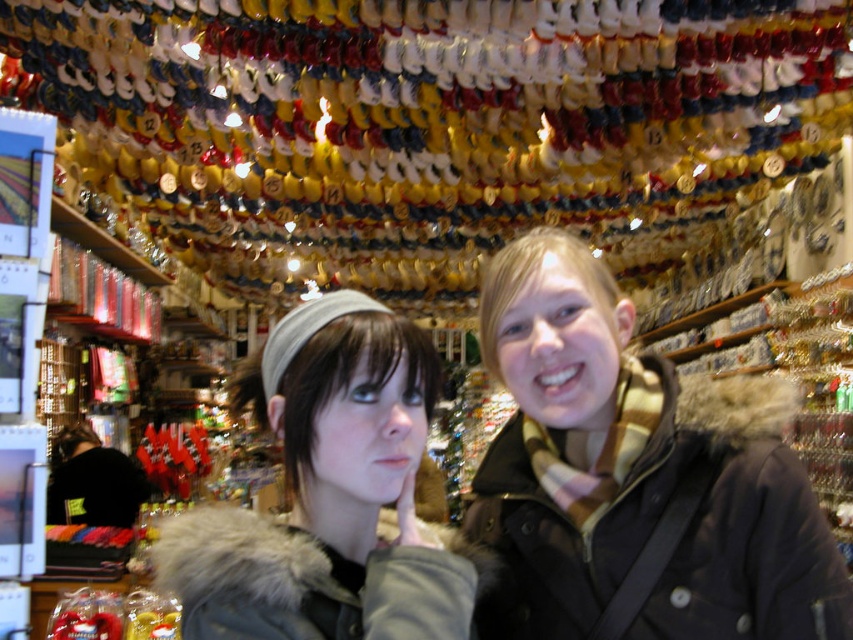
Question: Which of the following is the closest to the observer?

Choices:
 (A) (563, 490)
 (B) (308, 528)
 (C) (45, 509)

Answer: (B)

Question: Can you confirm if matte gray headband at center is thinner than black fuzzy jacket at lower left?

Choices:
 (A) no
 (B) yes

Answer: (B)

Question: Does green fur-lined coat at center appear over matte gray headband at center?

Choices:
 (A) yes
 (B) no

Answer: (B)

Question: Is green fur-lined coat at center to the right of black fuzzy jacket at lower left from the viewer's perspective?

Choices:
 (A) no
 (B) yes

Answer: (B)

Question: Which is farther from the green fur-lined coat at center?

Choices:
 (A) matte gray headband at center
 (B) black fuzzy jacket at lower left

Answer: (B)

Question: Which object appears closest to the camera in this image?

Choices:
 (A) green fur-lined coat at center
 (B) matte gray headband at center
 (C) black fuzzy jacket at lower left

Answer: (B)